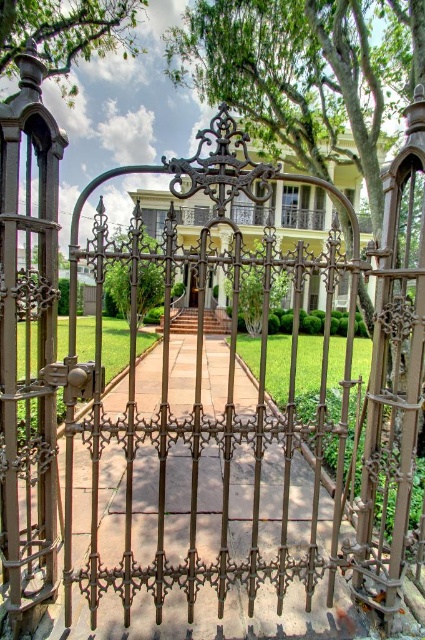
Question: Does green leafy tree at upper left appear on the left side of green leafy tree at center?

Choices:
 (A) yes
 (B) no

Answer: (A)

Question: Which object appears farthest from the camera in this image?

Choices:
 (A) green leafy tree at center
 (B) green leafy tree at upper left

Answer: (B)

Question: Based on their relative distances, which object is nearer to the green leafy tree at upper left?

Choices:
 (A) green leafy tree at center
 (B) matte bronze door at center

Answer: (A)

Question: Among these points, which one is nearest to the camera?

Choices:
 (A) (68, 42)
 (B) (112, 264)

Answer: (A)

Question: Can you confirm if green leafy tree at center is positioned to the right of matte bronze door at center?

Choices:
 (A) yes
 (B) no

Answer: (B)

Question: Does green leafy tree at upper left appear under green leafy tree at center?

Choices:
 (A) no
 (B) yes

Answer: (A)